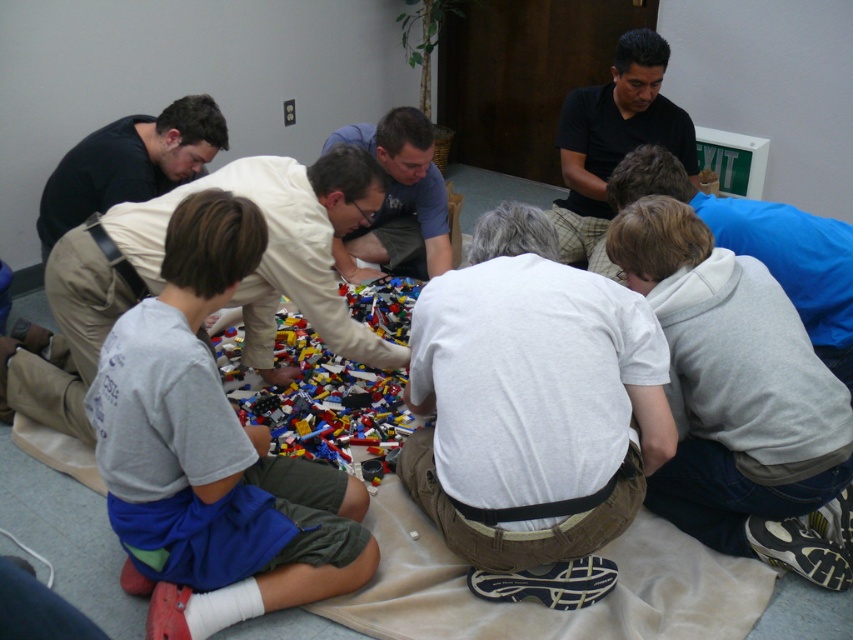
Who is positioned more to the left, white cotton shirt at center or translucent plastic lego bricks at center?

Positioned to the left is translucent plastic lego bricks at center.

Which of these two, white cotton shirt at center or translucent plastic lego bricks at center, stands taller?

Standing taller between the two is white cotton shirt at center.

Who is more distant from viewer, [553,292] or [363,419]?

Positioned behind is point [363,419].

Locate an element on the screen. This screenshot has width=853, height=640. white cotton shirt at center is located at coordinates (531, 401).

Who is taller, gray cotton shirt at center or matte blue shirt at center?

Standing taller between the two is gray cotton shirt at center.

Can you confirm if gray cotton shirt at center is bigger than matte blue shirt at center?

Correct, gray cotton shirt at center is larger in size than matte blue shirt at center.

At what (x,y) coordinates should I click in order to perform the action: click on gray cotton shirt at center. Please return your answer as a coordinate pair (x, y). Looking at the image, I should click on (210, 452).

Is gray cotton shirt at center thinner than black matte shirt at upper center?

No, gray cotton shirt at center is not thinner than black matte shirt at upper center.

Is gray cotton shirt at center wider than black matte shirt at upper center?

Correct, the width of gray cotton shirt at center exceeds that of black matte shirt at upper center.

Is point (219, 554) more distant than point (618, 54)?

That is False.

Locate an element on the screen. Image resolution: width=853 pixels, height=640 pixels. gray cotton shirt at center is located at coordinates (210, 452).